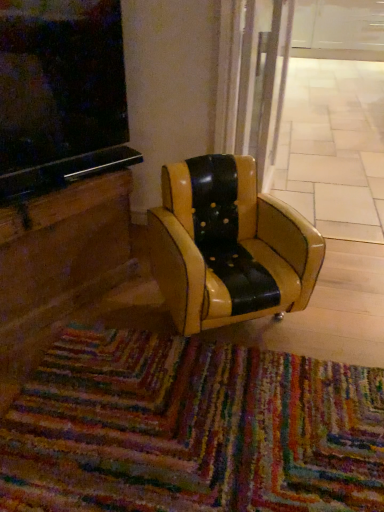
Question: Does multicolored woven mat at lower center have a larger size compared to transparent glass door at center?

Choices:
 (A) yes
 (B) no

Answer: (B)

Question: Is multicolored woven mat at lower center facing away from transparent glass door at center?

Choices:
 (A) no
 (B) yes

Answer: (A)

Question: Would you say multicolored woven mat at lower center is a long distance from transparent glass door at center?

Choices:
 (A) yes
 (B) no

Answer: (A)

Question: From a real-world perspective, is multicolored woven mat at lower center positioned under transparent glass door at center based on gravity?

Choices:
 (A) yes
 (B) no

Answer: (B)

Question: Can you confirm if multicolored woven mat at lower center is wider than transparent glass door at center?

Choices:
 (A) yes
 (B) no

Answer: (B)

Question: Looking at the image, does transparent glass door at center seem bigger or smaller compared to multicolored woven mat at lower center?

Choices:
 (A) big
 (B) small

Answer: (A)

Question: In terms of width, does transparent glass door at center look wider or thinner when compared to multicolored woven mat at lower center?

Choices:
 (A) thin
 (B) wide

Answer: (B)

Question: From the image's perspective, is transparent glass door at center positioned above or below multicolored woven mat at lower center?

Choices:
 (A) above
 (B) below

Answer: (A)

Question: Choose the correct answer: Is transparent glass door at center inside multicolored woven mat at lower center or outside it?

Choices:
 (A) outside
 (B) inside

Answer: (A)

Question: From a real-world perspective, is multicolored woven mat at lower center positioned above or below transparent glass door at center?

Choices:
 (A) above
 (B) below

Answer: (A)

Question: Would you say multicolored woven mat at lower center is to the left or to the right of transparent glass door at center in the picture?

Choices:
 (A) left
 (B) right

Answer: (A)

Question: Considering the positions of multicolored woven mat at lower center and transparent glass door at center in the image, is multicolored woven mat at lower center taller or shorter than transparent glass door at center?

Choices:
 (A) tall
 (B) short

Answer: (B)

Question: Relative to transparent glass door at center, is multicolored woven mat at lower center in front or behind?

Choices:
 (A) front
 (B) behind

Answer: (A)

Question: Is black leather chair at center taller or shorter than multicolored woven mat at lower center?

Choices:
 (A) tall
 (B) short

Answer: (A)

Question: Relative to multicolored woven mat at lower center, is black leather chair at center in front or behind?

Choices:
 (A) front
 (B) behind

Answer: (B)